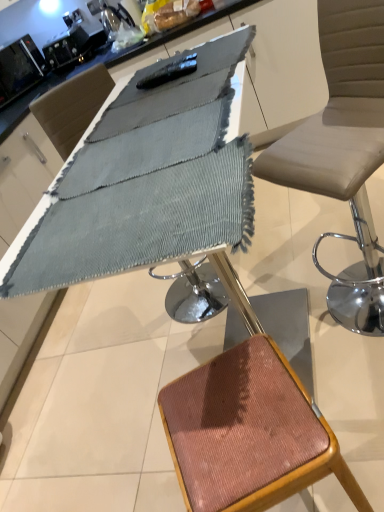
Find the location of a particular element. vacant area on top of rustic wood stool at lower right (from a real-world perspective) is located at coordinates (228, 415).